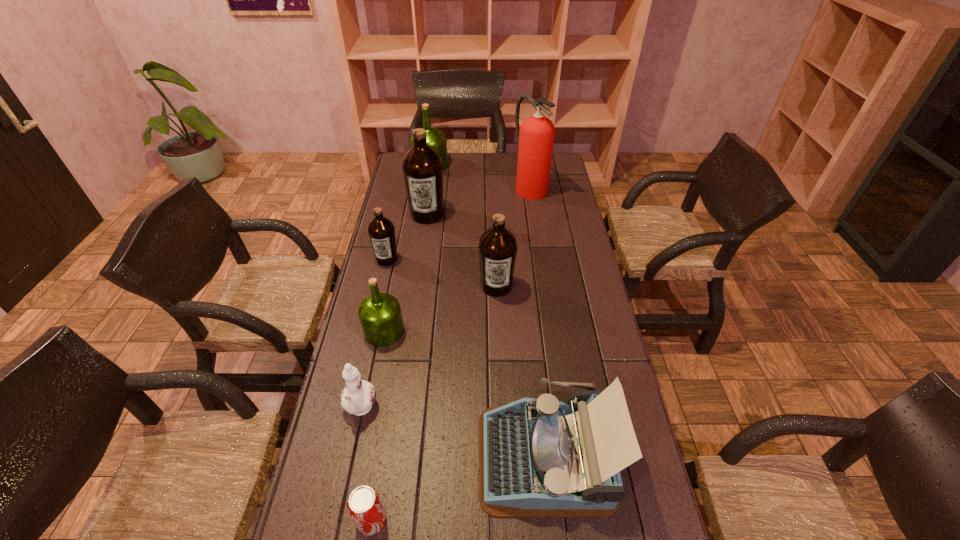
At what (x,y) coordinates should I click in order to perform the action: click on the smaller green olive oil. Please return your answer as a coordinate pair (x, y). Looking at the image, I should click on (380, 316).

I want to click on blue typewriter, so click(x=542, y=457).

Locate an element on the screen. chinaware is located at coordinates (358, 396).

Where is `soda can`? This screenshot has width=960, height=540. soda can is located at coordinates (364, 505).

Find the location of a particular element. This screenshot has height=540, width=960. free space located on the handle side of the fire extinguisher is located at coordinates (534, 212).

Locate an element on the screen. vacant area located on the label of the fourth nearest olive oil is located at coordinates (422, 246).

This screenshot has width=960, height=540. In order to click on blank space located 0.240m on the front of the farther green olive oil in this screenshot , I will do `click(424, 203)`.

The image size is (960, 540). What are the coordinates of `vacant space located 0.050m on the label of the rightmost olive oil` in the screenshot? It's located at (497, 310).

Locate an element on the screen. The image size is (960, 540). vacant space situated 0.310m on the label of the third nearest olive oil is located at coordinates click(370, 333).

This screenshot has height=540, width=960. What are the coordinates of `free point located 0.110m on the back of the smaller green olive oil` in the screenshot? It's located at (x=392, y=292).